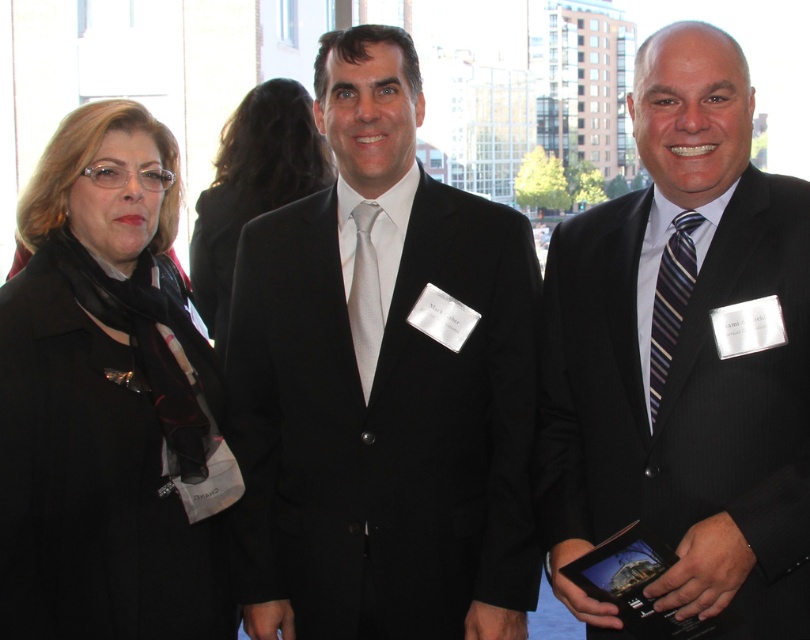
Question: Which point is farther to the camera?

Choices:
 (A) matte black suit at center
 (B) striped silk tie at right

Answer: (B)

Question: Is matte black suit at center further to the viewer compared to white silk tie at center?

Choices:
 (A) yes
 (B) no

Answer: (B)

Question: Which object is closer to the camera taking this photo?

Choices:
 (A) white silk tie at center
 (B) black wool coat at left
 (C) matte black coat at center

Answer: (B)

Question: Which of the following is the farthest from the observer?

Choices:
 (A) click(28, 372)
 (B) click(318, 132)

Answer: (B)

Question: Can you confirm if matte black coat at center is positioned above white silk tie at center?

Choices:
 (A) yes
 (B) no

Answer: (A)

Question: Is black wool coat at left behind matte black coat at center?

Choices:
 (A) yes
 (B) no

Answer: (B)